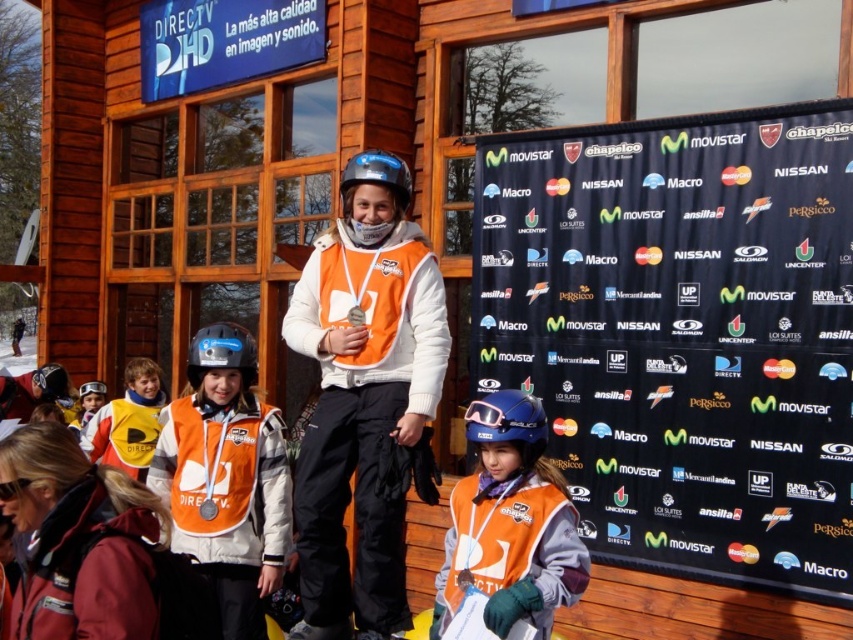
Is the position of black fabric banner at center more distant than that of orange fabric vest at center?

Yes, black fabric banner at center is behind orange fabric vest at center.

Is black fabric banner at center to the left of orange fabric vest at center from the viewer's perspective?

Incorrect, black fabric banner at center is not on the left side of orange fabric vest at center.

Which is behind, point (676, 252) or point (432, 368)?

Point (676, 252)

Locate an element on the screen. black fabric banner at center is located at coordinates (682, 333).

Can you confirm if black fabric banner at center is positioned to the right of yellowmaterialjacket at left?

Yes, black fabric banner at center is to the right of yellowmaterialjacket at left.

Does point (639, 240) come closer to viewer compared to point (105, 442)?

Yes, point (639, 240) is closer to viewer.

The width and height of the screenshot is (853, 640). I want to click on black fabric banner at center, so click(x=682, y=333).

Between matte orange vest at center and yellowmaterialjacket at left, which one is positioned lower?

Positioned lower is yellowmaterialjacket at left.

Is matte orange vest at center to the left of yellowmaterialjacket at left from the viewer's perspective?

In fact, matte orange vest at center is to the right of yellowmaterialjacket at left.

Does point (196, 532) lie in front of point (144, 396)?

Yes, it is.

Identify the location of matte orange vest at center. This screenshot has height=640, width=853. (225, 477).